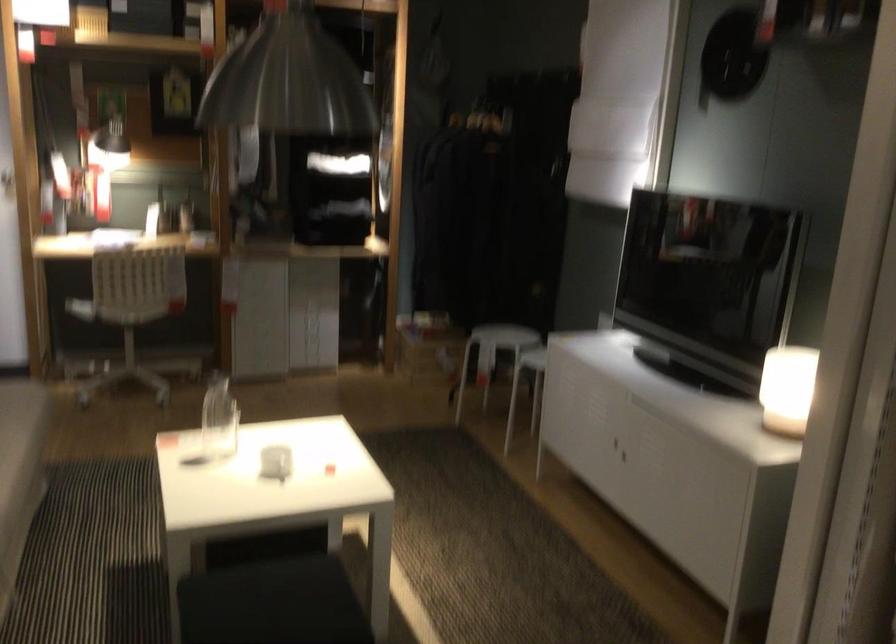
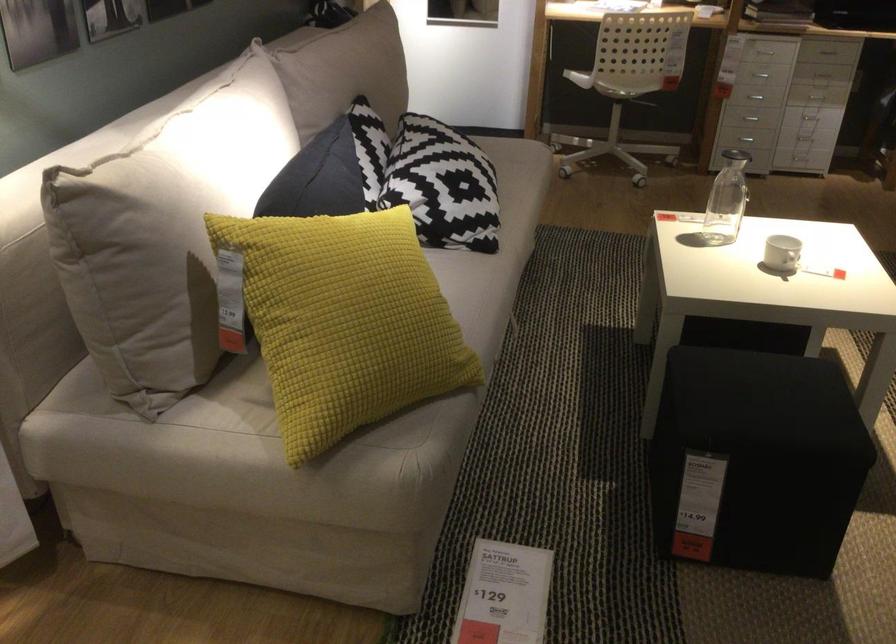
Find the pixel in the second image that matches pixel 278 468 in the first image.

(781, 252)